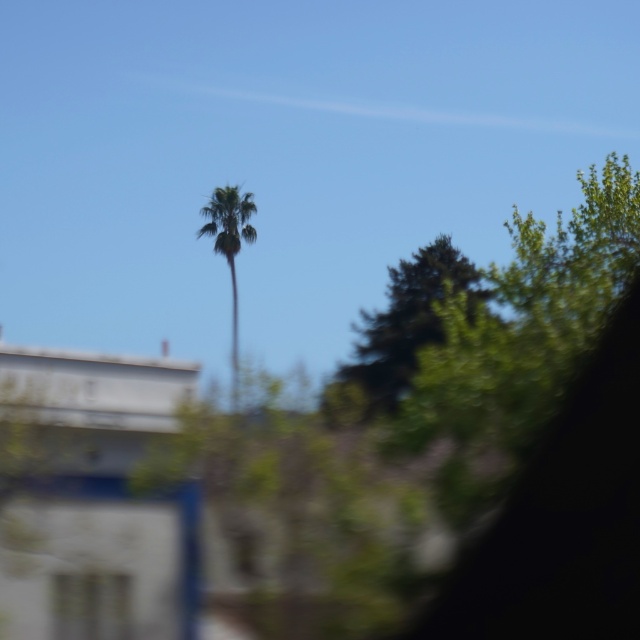
You are driving a car and notice the transparent glass car window at lower left and the green leafy palm tree at center through the window. Which object appears taller in the scene?

The green leafy palm tree at center appears taller than the transparent glass car window at lower left.